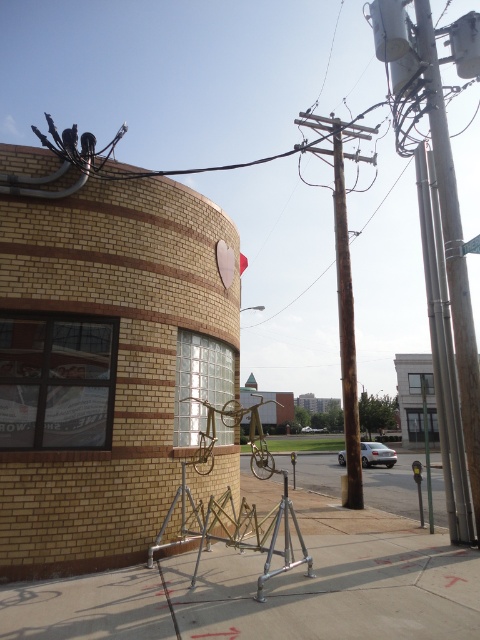
The width and height of the screenshot is (480, 640). What do you see at coordinates (344, 292) in the screenshot? I see `rusty wood telegraph pole at center` at bounding box center [344, 292].

Who is taller, rusty wood telegraph pole at center or metallic street sign at lower right?

rusty wood telegraph pole at center

Image resolution: width=480 pixels, height=640 pixels. What do you see at coordinates (344, 292) in the screenshot?
I see `rusty wood telegraph pole at center` at bounding box center [344, 292].

At what (x,y) coordinates should I click in order to perform the action: click on rusty wood telegraph pole at center. Please return your answer as a coordinate pair (x, y). This screenshot has width=480, height=640. Looking at the image, I should click on (344, 292).

Who is lower down, rusty metal pole at right or concrete sidewalk at lower center?

Positioned lower is concrete sidewalk at lower center.

Is point (466, 416) more distant than point (442, 493)?

No, (466, 416) is in front of (442, 493).

Does point (436, 76) come closer to viewer compared to point (364, 496)?

Yes, point (436, 76) is in front of point (364, 496).

The width and height of the screenshot is (480, 640). What are the coordinates of `rusty metal pole at right` in the screenshot? It's located at (453, 252).

Describe the element at coordinates (392, 486) in the screenshot. Image resolution: width=480 pixels, height=640 pixels. I see `concrete sidewalk at lower center` at that location.

Which is more to the left, concrete sidewalk at lower center or metallic street sign at lower right?

From the viewer's perspective, metallic street sign at lower right appears more on the left side.

Is point (336, 464) closer to camera compared to point (422, 513)?

No, it is not.

The width and height of the screenshot is (480, 640). What are the coordinates of `concrete sidewalk at lower center` in the screenshot? It's located at (392, 486).